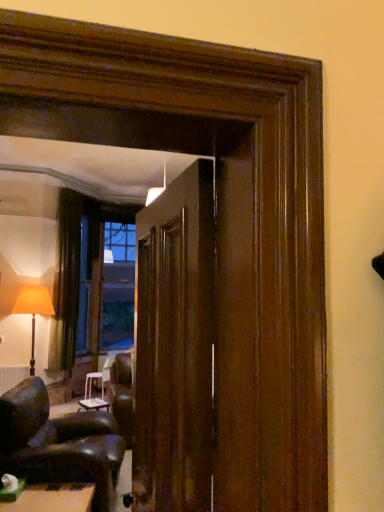
Question: Is green felt table at lower left, the 2th table when ordered from bottom to top, facing towards leather armchair at lower left?

Choices:
 (A) no
 (B) yes

Answer: (A)

Question: Does green felt table at lower left, which is the second table from top to bottom, have a lesser width compared to leather armchair at lower left?

Choices:
 (A) yes
 (B) no

Answer: (A)

Question: Can you confirm if green felt table at lower left, acting as the 3th table starting from the back, is wider than leather armchair at lower left?

Choices:
 (A) yes
 (B) no

Answer: (B)

Question: From a real-world perspective, is green felt table at lower left, the 2th table when ordered from bottom to top, positioned over leather armchair at lower left based on gravity?

Choices:
 (A) yes
 (B) no

Answer: (B)

Question: Is green felt table at lower left, which is the second table from top to bottom, at the right side of leather armchair at lower left?

Choices:
 (A) yes
 (B) no

Answer: (A)

Question: From the image's perspective, is white plastic stool at center, the 1th table positioned from the bottom, positioned above or below dark brown fabric curtain at left?

Choices:
 (A) below
 (B) above

Answer: (A)

Question: Considering the positions of white plastic stool at center, the 3th table in the front-to-back sequence, and dark brown fabric curtain at left in the image, is white plastic stool at center, the 3th table in the front-to-back sequence, bigger or smaller than dark brown fabric curtain at left?

Choices:
 (A) small
 (B) big

Answer: (A)

Question: Relative to dark brown fabric curtain at left, is white plastic stool at center, the 3th table in the front-to-back sequence, in front or behind?

Choices:
 (A) front
 (B) behind

Answer: (B)

Question: From a real-world perspective, relative to dark brown fabric curtain at left, is white plastic stool at center, the 1th table positioned from the bottom, vertically above or below?

Choices:
 (A) below
 (B) above

Answer: (A)

Question: Is matte orange fabric lampshade at left taller or shorter than dark brown fabric curtain at left?

Choices:
 (A) short
 (B) tall

Answer: (A)

Question: From the image's perspective, is matte orange fabric lampshade at left positioned above or below dark brown fabric curtain at left?

Choices:
 (A) below
 (B) above

Answer: (A)

Question: Looking at the image, does matte orange fabric lampshade at left seem bigger or smaller compared to dark brown fabric curtain at left?

Choices:
 (A) small
 (B) big

Answer: (B)

Question: Considering the positions of matte orange fabric lampshade at left and dark brown fabric curtain at left in the image, is matte orange fabric lampshade at left wider or thinner than dark brown fabric curtain at left?

Choices:
 (A) thin
 (B) wide

Answer: (B)

Question: From the image's perspective, is white matte radiator at lower left located above or below white plastic stool at center, marked as the third table in a top-to-bottom arrangement?

Choices:
 (A) below
 (B) above

Answer: (B)

Question: Is white matte radiator at lower left bigger or smaller than white plastic stool at center, marked as the third table in a top-to-bottom arrangement?

Choices:
 (A) big
 (B) small

Answer: (B)